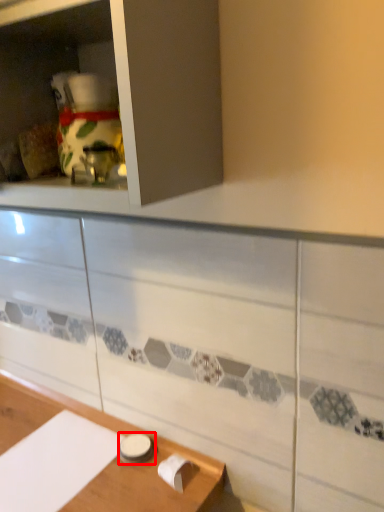
Question: Considering the relative positions of tableware (annotated by the red box) and cabinetry in the image provided, where is tableware (annotated by the red box) located with respect to the staircase?

Choices:
 (A) left
 (B) right

Answer: (B)